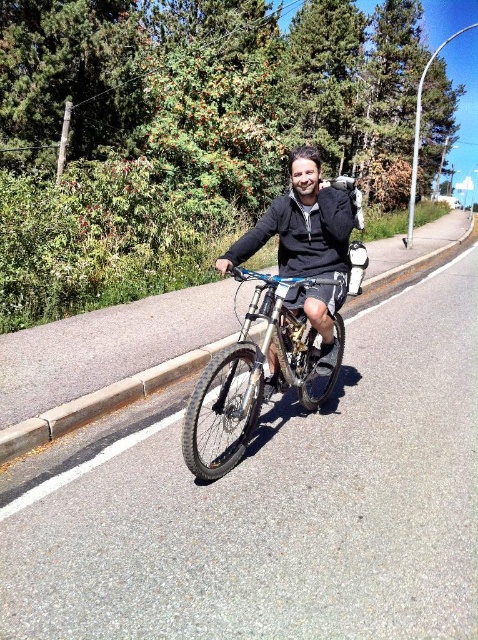
Locate an element on the screen. shiny metallic bicycle at center is located at coordinates (260, 369).

Can you confirm if shiny metallic bicycle at center is thinner than black matte jacket at center?

No.

Measure the distance between point (239, 397) and camera.

12.28 feet

At what (x,y) coordinates should I click in order to perform the action: click on shiny metallic bicycle at center. Please return your answer as a coordinate pair (x, y). The image size is (478, 640). Looking at the image, I should click on (260, 369).